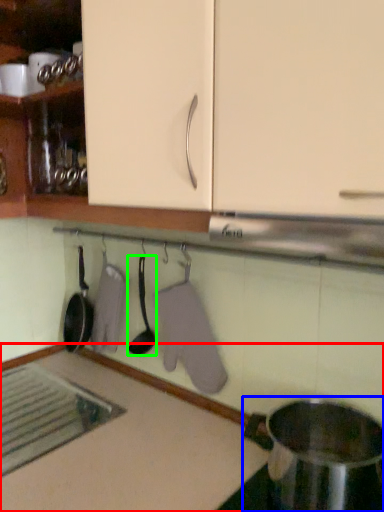
Question: Which is farther away from countertop (highlighted by a red box)? appliance (highlighted by a blue box) or spoon (highlighted by a green box)?

Choices:
 (A) appliance
 (B) spoon

Answer: (B)